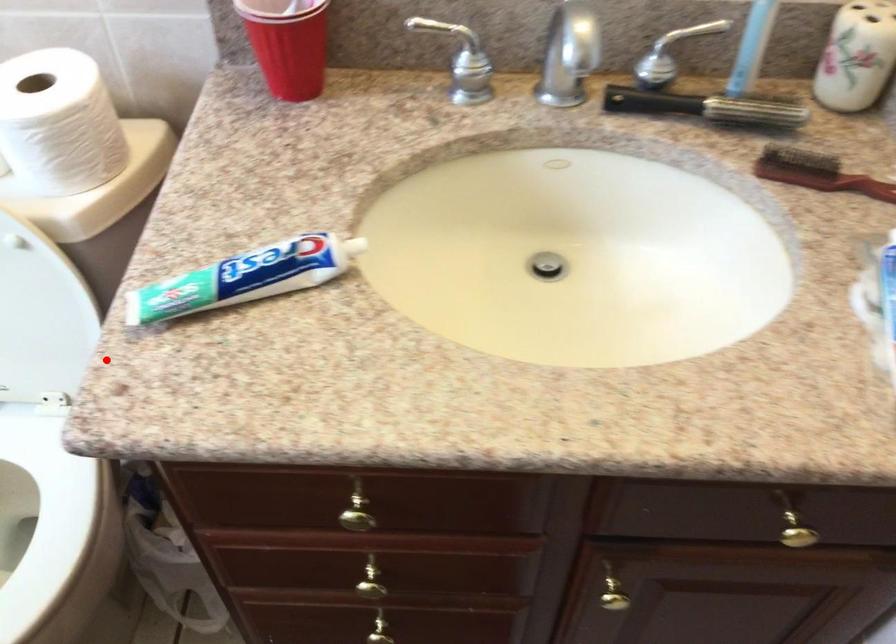
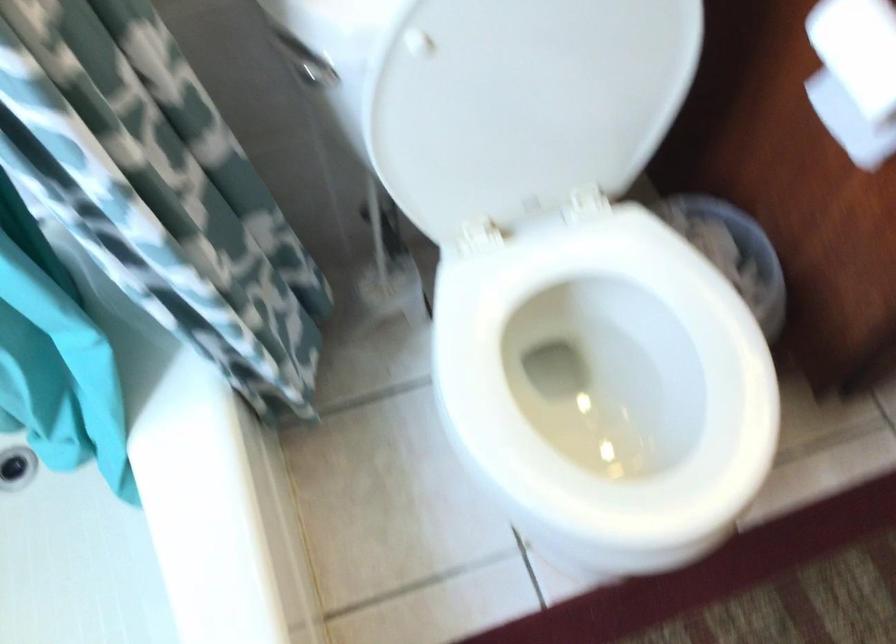
In the second image, find the point that corresponds to the highlighted location in the first image.

(855, 76)